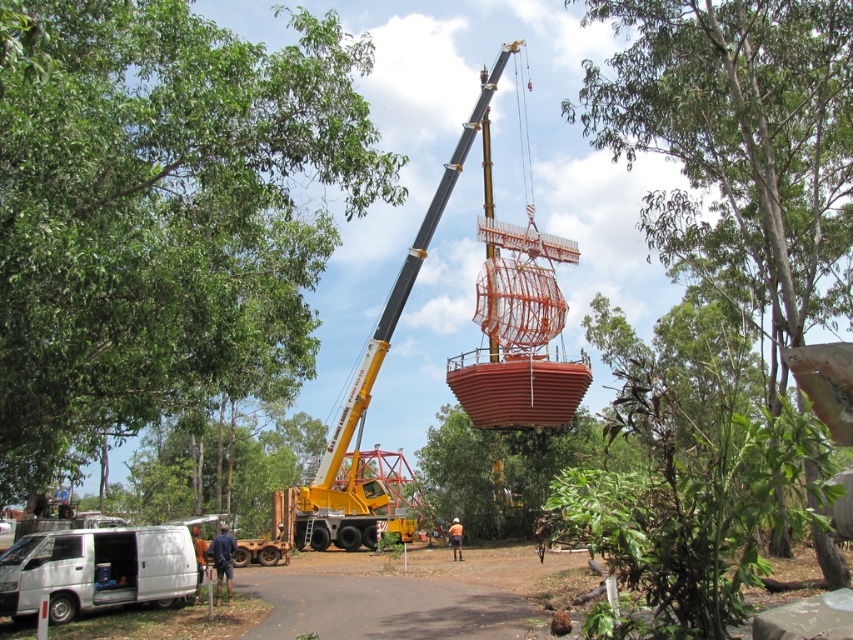
Question: Estimate the real-world distances between objects in this image. Which object is farther from the green leafy tree at center?

Choices:
 (A) green leafy tree at upper center
 (B) green leafy tree at upper left

Answer: (B)

Question: Can you confirm if green leafy tree at center is positioned below yellow metallic crane at center?

Choices:
 (A) no
 (B) yes

Answer: (B)

Question: Where is green leafy tree at center located in relation to brown leather jacket at lower left in the image?

Choices:
 (A) left
 (B) right

Answer: (B)

Question: Based on their relative distances, which object is farther from the white matte van at lower left?

Choices:
 (A) yellow metallic crane at center
 (B) green leafy tree at center
 (C) green leafy tree at upper left
 (D) orange reflective vest at center

Answer: (B)

Question: Can you confirm if green leafy tree at upper center is smaller than brown leather jacket at lower left?

Choices:
 (A) no
 (B) yes

Answer: (A)

Question: Based on their relative distances, which object is farther from the green leafy tree at upper left?

Choices:
 (A) white matte van at lower left
 (B) yellow metallic crane at center
 (C) orange reflective vest at center

Answer: (C)